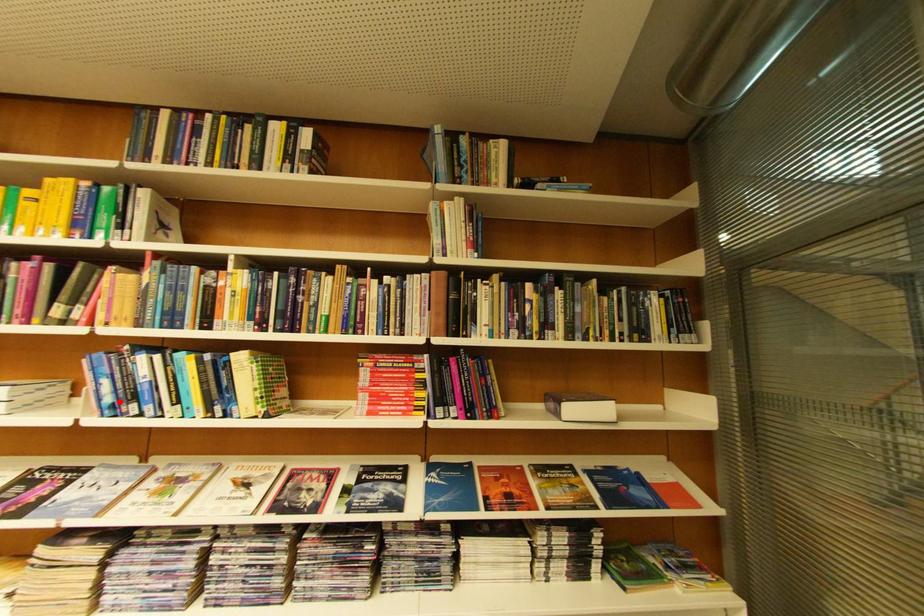
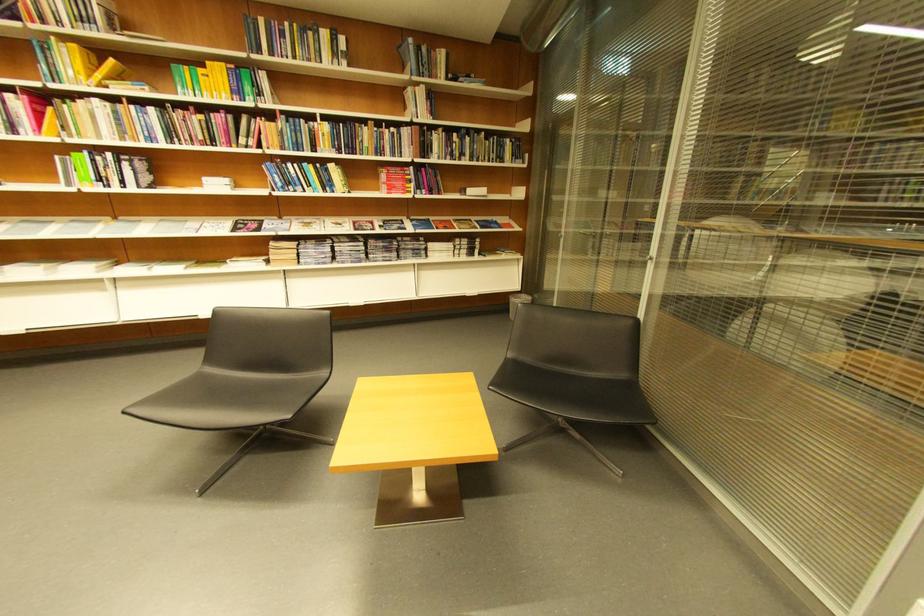
In the second image, find the point that corresponds to the highlighted location in the first image.

(290, 185)